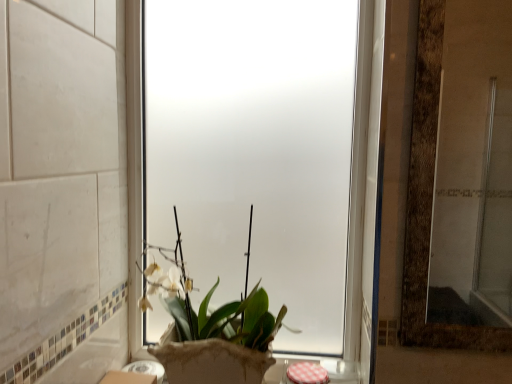
Question: Is green matte plant at center at the left side of frosted glass window at center?

Choices:
 (A) no
 (B) yes

Answer: (B)

Question: Is there a large distance between green matte plant at center and frosted glass window at center?

Choices:
 (A) yes
 (B) no

Answer: (B)

Question: From a real-world perspective, is green matte plant at center physically above frosted glass window at center?

Choices:
 (A) yes
 (B) no

Answer: (B)

Question: Is green matte plant at center aimed at frosted glass window at center?

Choices:
 (A) no
 (B) yes

Answer: (A)

Question: Can you confirm if green matte plant at center is thinner than frosted glass window at center?

Choices:
 (A) yes
 (B) no

Answer: (B)

Question: Does green matte plant at center appear on the right side of frosted glass window at center?

Choices:
 (A) yes
 (B) no

Answer: (B)

Question: Are frosted glass window at center and green matte plant at center beside each other?

Choices:
 (A) no
 (B) yes

Answer: (A)

Question: Is frosted glass window at center oriented away from green matte plant at center?

Choices:
 (A) yes
 (B) no

Answer: (A)

Question: From a real-world perspective, is frosted glass window at center under green matte plant at center?

Choices:
 (A) yes
 (B) no

Answer: (B)

Question: Would you say frosted glass window at center is a long distance from green matte plant at center?

Choices:
 (A) no
 (B) yes

Answer: (A)

Question: Does frosted glass window at center appear on the right side of green matte plant at center?

Choices:
 (A) yes
 (B) no

Answer: (A)

Question: From the image's perspective, is frosted glass window at center located beneath green matte plant at center?

Choices:
 (A) no
 (B) yes

Answer: (A)

Question: Is frosted glass window at center taller or shorter than green matte plant at center?

Choices:
 (A) short
 (B) tall

Answer: (B)